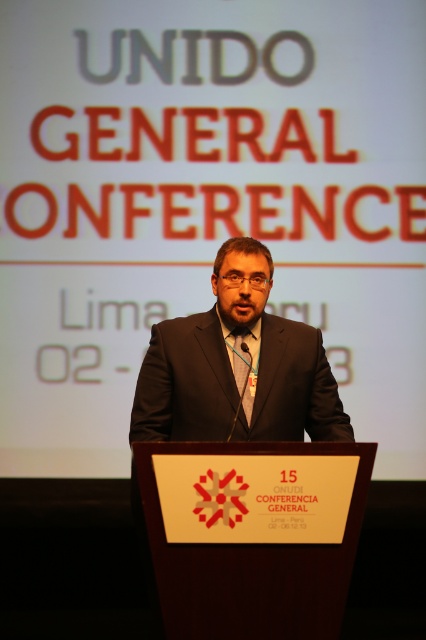
You are a fashion designer analyzing the man in the dark gray suit at center and the matte black tie at center. Which clothing item is taller?

The dark gray suit at center is much taller than the matte black tie at center.

Looking at this image, you are attending the UNIDO General Conference in Lima and need to locate the speaker wearing a dark gray suit at center. According to the coordinates provided, where exactly is the speaker positioned in the image?

The dark gray suit at center is located at point coordinates 0.573 in the x axis and 0.556 in the y axis.